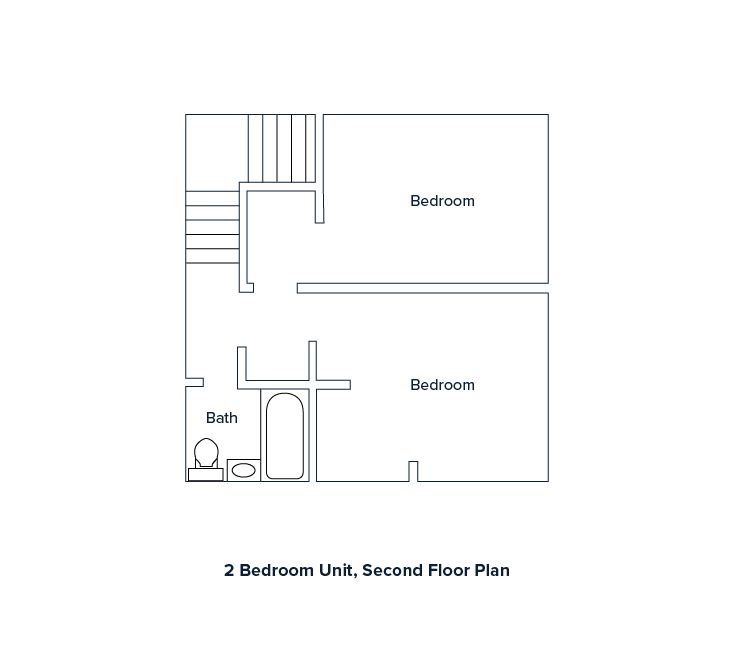
This screenshot has width=734, height=649. I want to click on hallway, so click(218, 317).